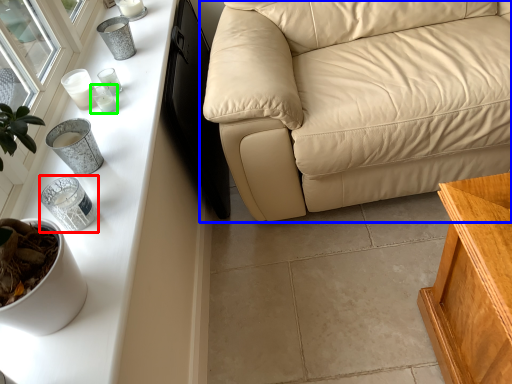
Question: Which object is the closest to the candle holder (highlighted by a red box)? Choose among these: studio couch (highlighted by a blue box) or candle holder (highlighted by a green box).

Choices:
 (A) studio couch
 (B) candle holder

Answer: (B)